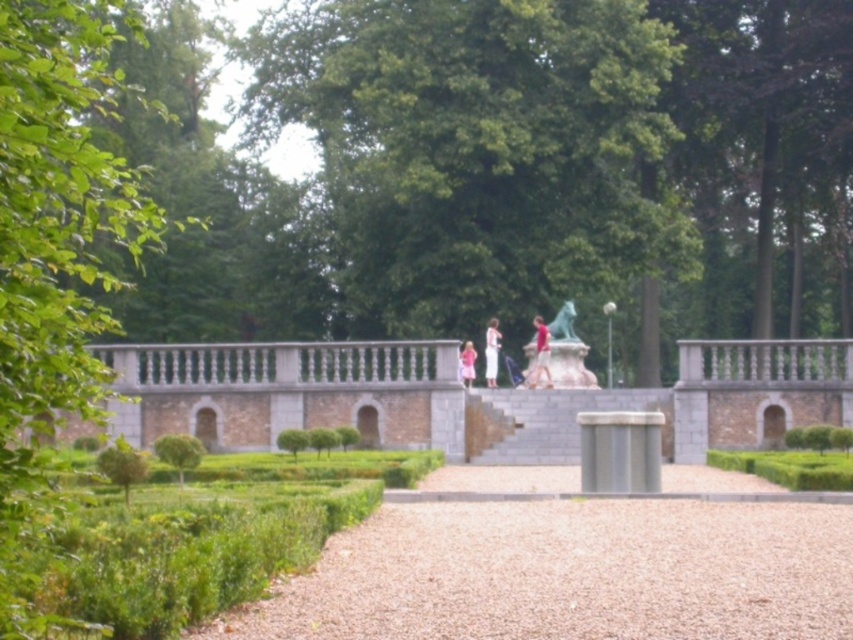
Is green leafy hedge at lower left above green leafy hedge at center?

Correct, green leafy hedge at lower left is located above green leafy hedge at center.

Is point (165, 532) positioned behind point (316, 444)?

No, it is in front of (316, 444).

In order to click on green leafy hedge at lower left in this screenshot , I will do `click(204, 538)`.

Find the location of a particular element. green leafy hedge at lower left is located at coordinates (204, 538).

Does point (360, 492) come farther from viewer compared to point (567, 314)?

No.

Looking at this image, between green leafy hedge at lower left and green marble statue at center, which one has less height?

Standing shorter between the two is green marble statue at center.

Who is more distant from viewer, (97, 579) or (556, 342)?

Positioned behind is point (556, 342).

Where is `green leafy hedge at lower left`? green leafy hedge at lower left is located at coordinates point(204,538).

Is green marble statue at center to the right of green leafy hedge at center from the viewer's perspective?

Correct, you'll find green marble statue at center to the right of green leafy hedge at center.

Image resolution: width=853 pixels, height=640 pixels. What do you see at coordinates (567, 352) in the screenshot?
I see `green marble statue at center` at bounding box center [567, 352].

Locate an element on the screen. This screenshot has width=853, height=640. green marble statue at center is located at coordinates (567, 352).